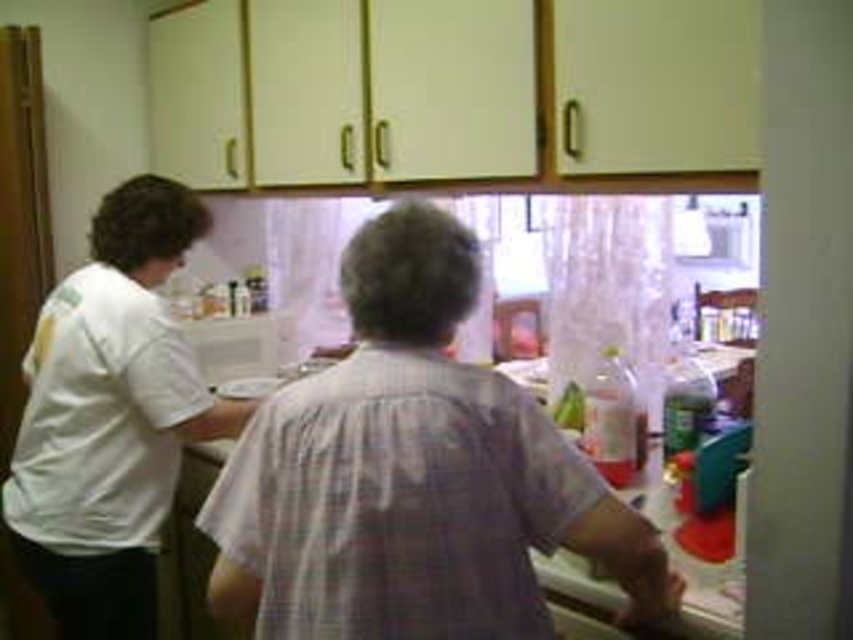
You are trying to decide which shirt to wear for a casual day out. You have two options in front of you on the kitchen counter. The white cotton shirt at center and the white matte shirt at left. Based on their sizes, which one might be more suitable if you prefer a shorter sleeve length?

The white cotton shirt at center is shorter than the white matte shirt at left, so it would be more suitable if you prefer a shorter sleeve length.

You are trying to decide which shirt to wear for a casual day out. Both the white cotton shirt at center and the white matte shirt at left are options. Based on their appearance in the kitchen scene, which shirt has a looser fit?

The white cotton shirt at center has a looser fit since it might be wider than the white matte shirt at left.

You are standing in the kitchen and want to reach the point marked at coordinates (231, 477). Can you safely extend your arm to touch this point without stretching too far?

The point at coordinates (231, 477) is 1.36 meters away from you. Since the average human arm length is about 0.7 meters, you cannot comfortably reach it without stretching too far.